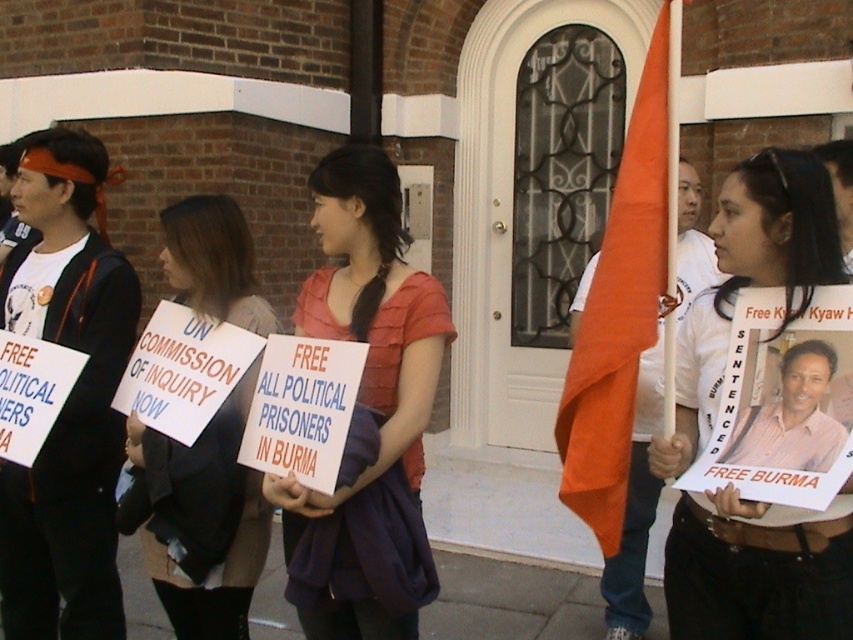
You are a photographer at the protest scene. You want to take a photo that includes both the matte white shirt at center and the matte pink blouse at center. Which of the two should you focus on first if you want to ensure both are in frame without moving the camera?

You should focus on the matte white shirt at center first because it is shorter than the matte pink blouse at center, allowing you to frame both by adjusting the camera angle to include the taller blouse without moving the camera.

You are a photographer trying to capture a clear photo of the matte white shirt at center and the black fabric sign at center. Which object should you focus on first if you want to ensure both are in focus, considering their sizes?

The matte white shirt at center is bigger than the black fabric sign at center, so you should focus on the matte white shirt at center first to ensure both are in focus.